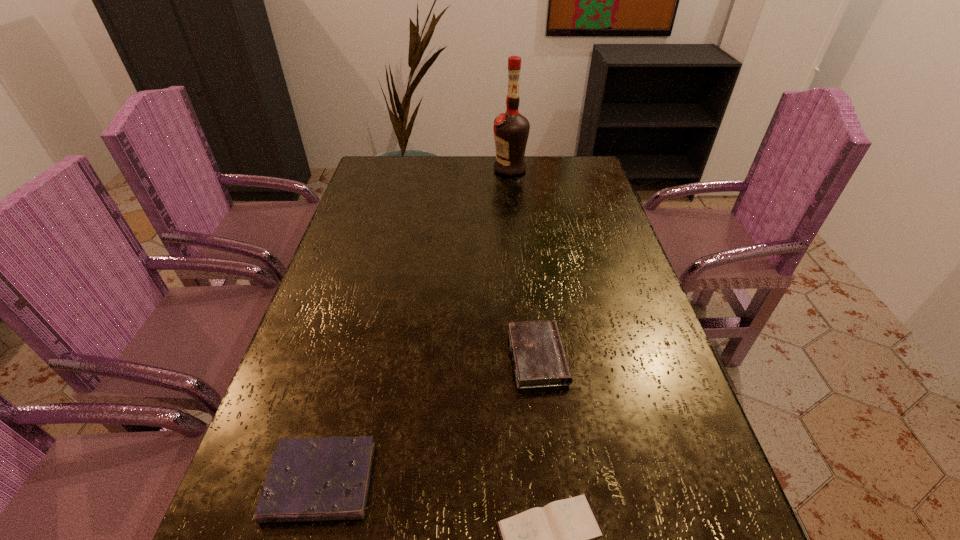
Locate an element on the screen. The height and width of the screenshot is (540, 960). vacant space situated 0.100m on the right of the third tallest object is located at coordinates (428, 482).

At what (x,y) coordinates should I click in order to perform the action: click on object that is positioned at the far edge. Please return your answer as a coordinate pair (x, y). Image resolution: width=960 pixels, height=540 pixels. Looking at the image, I should click on (511, 129).

Where is `object at the left edge`? The height and width of the screenshot is (540, 960). object at the left edge is located at coordinates point(310,479).

At what (x,y) coordinates should I click in order to perform the action: click on vacant region at the far edge. Please return your answer as a coordinate pair (x, y). The height and width of the screenshot is (540, 960). Looking at the image, I should click on (508, 177).

This screenshot has height=540, width=960. Find the location of `vacant space at the left edge of the desktop`. vacant space at the left edge of the desktop is located at coordinates point(349,245).

In the image, there is a desktop. At what (x,y) coordinates should I click in order to perform the action: click on vacant space at the right edge. Please return your answer as a coordinate pair (x, y). The width and height of the screenshot is (960, 540). Looking at the image, I should click on (690, 412).

Image resolution: width=960 pixels, height=540 pixels. In the image, there is a desktop. Find the location of `vacant space at the far left corner`. vacant space at the far left corner is located at coordinates (372, 164).

In the image, there is a desktop. What are the coordinates of `free region at the far right corner` in the screenshot? It's located at (578, 156).

Image resolution: width=960 pixels, height=540 pixels. Find the location of `free space between the second tallest object and the farthest object`. free space between the second tallest object and the farthest object is located at coordinates (524, 263).

Where is `empty location between the liquor and the leftmost diary`? The width and height of the screenshot is (960, 540). empty location between the liquor and the leftmost diary is located at coordinates (415, 325).